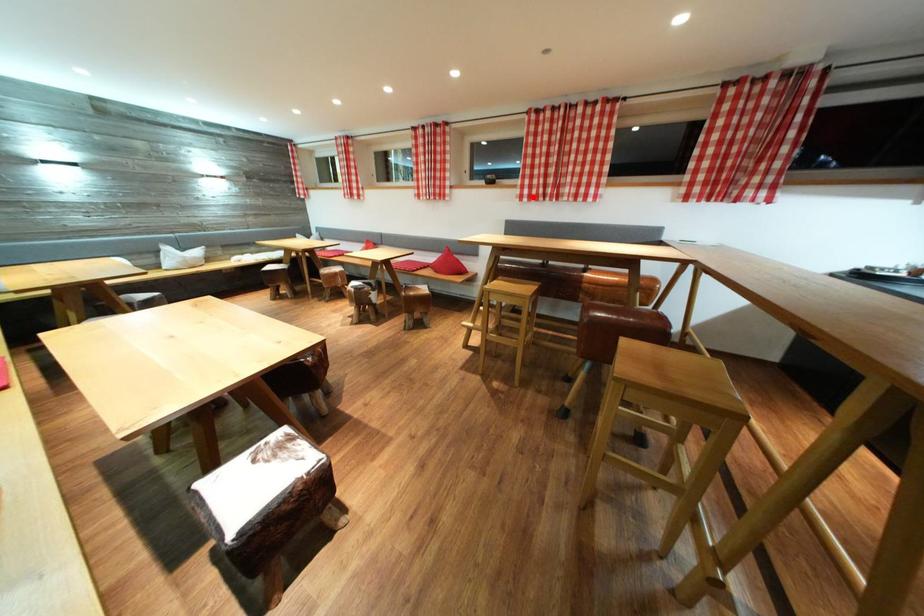
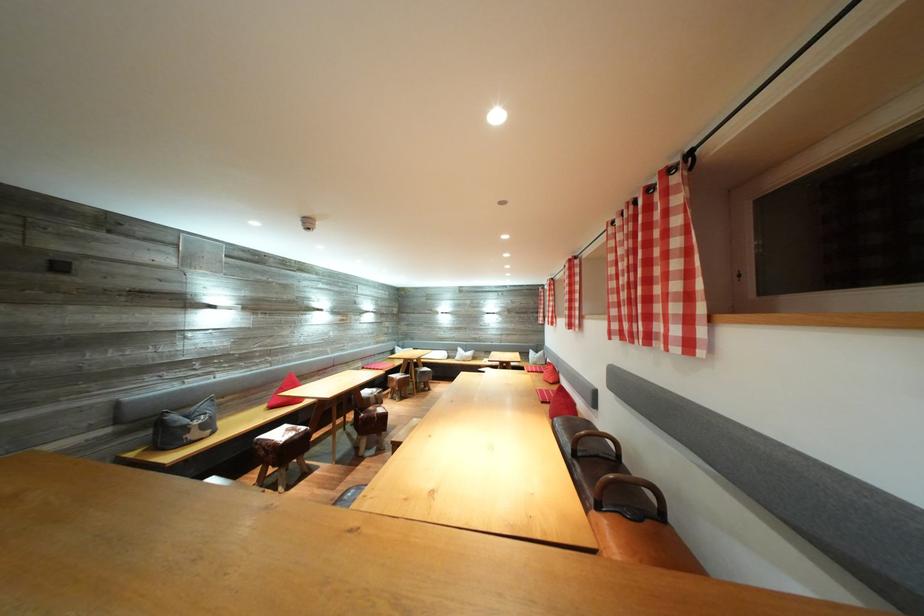
The point at the highlighted location is marked in the first image. Where is the corresponding point in the second image?

(622, 331)